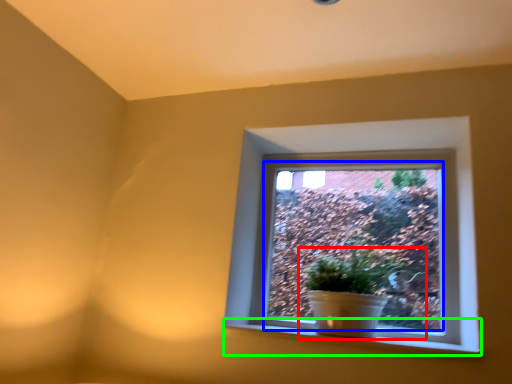
Question: Considering the real-world distances, which object is farthest from houseplant (highlighted by a red box)? window screen (highlighted by a blue box) or window sill (highlighted by a green box)?

Choices:
 (A) window screen
 (B) window sill

Answer: (B)